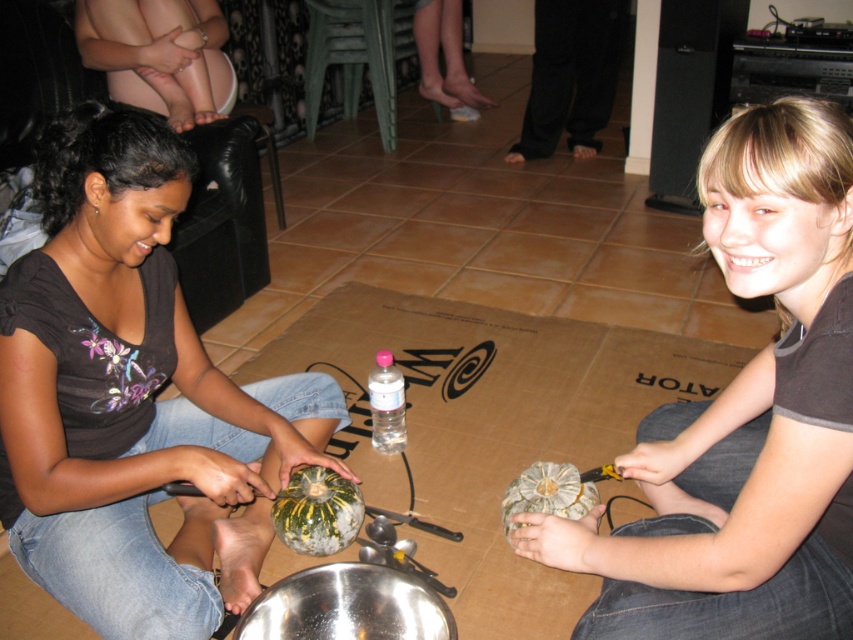
Question: Is smooth skin at upper left to the left of green textured gourd at lower center from the viewer's perspective?

Choices:
 (A) no
 (B) yes

Answer: (B)

Question: Which of the following is the closest to the observer?

Choices:
 (A) (378, 356)
 (B) (717, 541)
 (C) (546, 476)

Answer: (B)

Question: Does green textured gourd at lower center appear on the left side of clear plastic bottle at center?

Choices:
 (A) yes
 (B) no

Answer: (B)

Question: From the image, what is the correct spatial relationship of smooth skin at upper left in relation to green striped squash at center?

Choices:
 (A) left
 (B) right

Answer: (A)

Question: Among these points, which one is nearest to the camera?

Choices:
 (A) (759, 499)
 (B) (375, 387)
 (C) (111, 76)
 (D) (549, 508)

Answer: (A)

Question: Among these objects, which one is farthest from the camera?

Choices:
 (A) smooth skin at upper left
 (B) matte green pumpkin at lower left
 (C) green striped squash at center

Answer: (A)